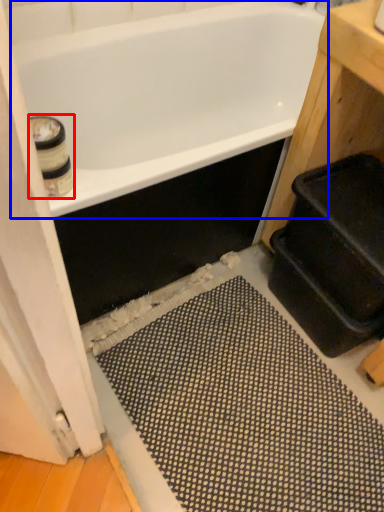
Question: Which object is closer to the camera taking this photo, toilet paper (highlighted by a red box) or bathtub (highlighted by a blue box)?

Choices:
 (A) toilet paper
 (B) bathtub

Answer: (A)